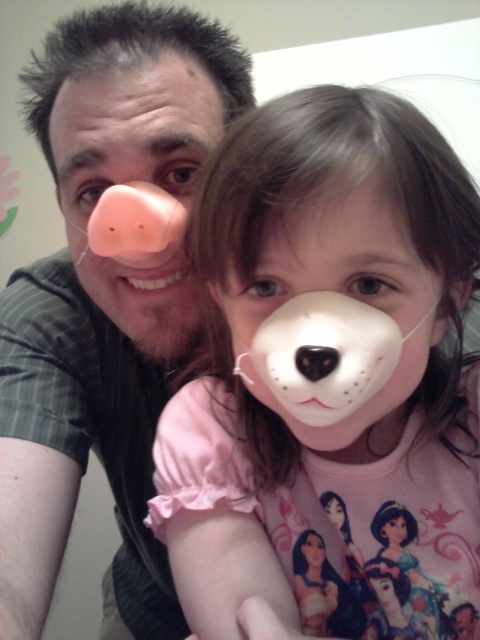
Is point (392, 328) positioned after point (319, 552)?

No, it is in front of (319, 552).

Between white rubber dog nose at upper center and smooth pink bear mask at center, which one is positioned lower?

smooth pink bear mask at center is lower down.

Who is more forward, [348,328] or [313,540]?

Positioned in front is point [348,328].

I want to click on white rubber dog nose at upper center, so 324,355.

Between matte pink nose at upper left and white matte bear mask at center, which one appears on the right side from the viewer's perspective?

From the viewer's perspective, white matte bear mask at center appears more on the right side.

Who is shorter, matte pink nose at upper left or white matte bear mask at center?

white matte bear mask at center

Where is `matte pink nose at upper left`? This screenshot has width=480, height=640. matte pink nose at upper left is located at coordinates (104, 298).

Find the location of a particular element. This screenshot has width=480, height=640. matte pink nose at upper left is located at coordinates (104, 298).

Is white matte dog nose mask at center below matte pink nose at upper left?

Incorrect, white matte dog nose mask at center is not positioned below matte pink nose at upper left.

Describe the element at coordinates (330, 378) in the screenshot. I see `white matte dog nose mask at center` at that location.

Is point (310, 314) positioned in front of point (177, 268)?

That is True.

Identify the location of white matte dog nose mask at center. (330, 378).